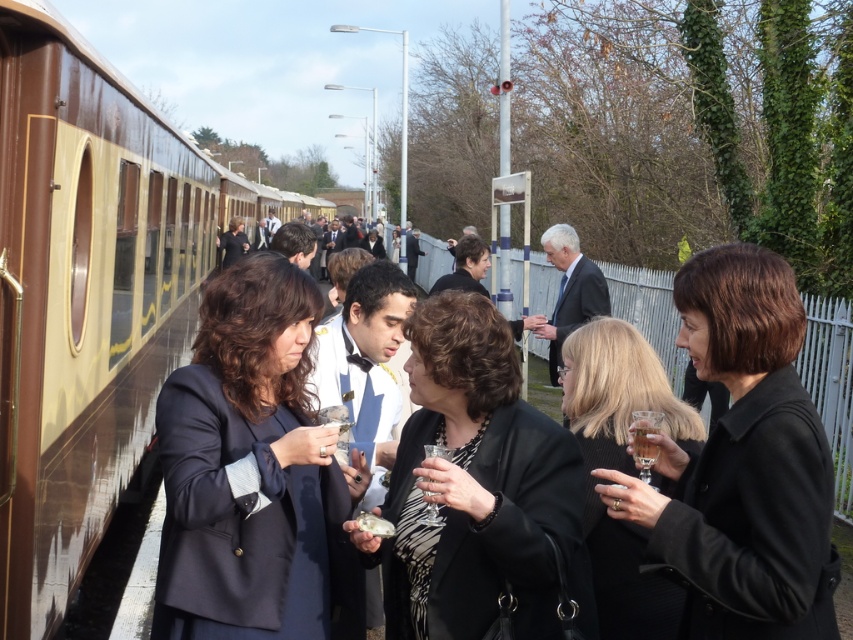
Question: Can you confirm if brown polished wood passenger train at left is bigger than blonde hair at center?

Choices:
 (A) no
 (B) yes

Answer: (B)

Question: Is blonde hair at center bigger than clear glass at center?

Choices:
 (A) yes
 (B) no

Answer: (A)

Question: Considering the real-world distances, which object is closest to the navy blue fabric at center?

Choices:
 (A) black textured dress at center
 (B) black matte coat at right
 (C) blonde hair at center
 (D) clear glass at center

Answer: (A)

Question: Which of the following is the farthest from the observer?

Choices:
 (A) blonde hair at center
 (B) black textured dress at center

Answer: (A)

Question: Which of the following is the closest to the observer?

Choices:
 (A) (444, 465)
 (B) (605, 365)
 (C) (32, 234)

Answer: (A)

Question: Does navy blue fabric at center have a smaller size compared to black matte coat at right?

Choices:
 (A) yes
 (B) no

Answer: (B)